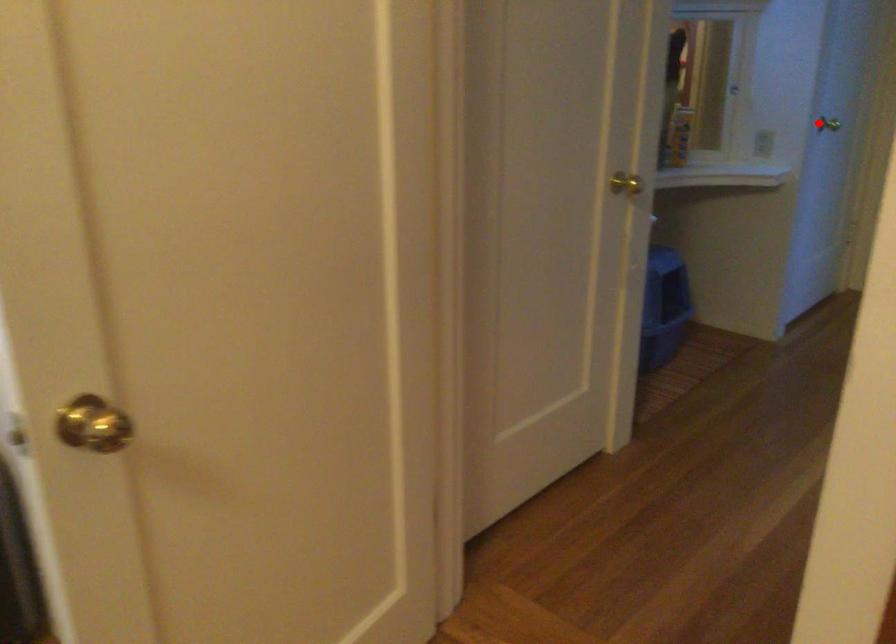
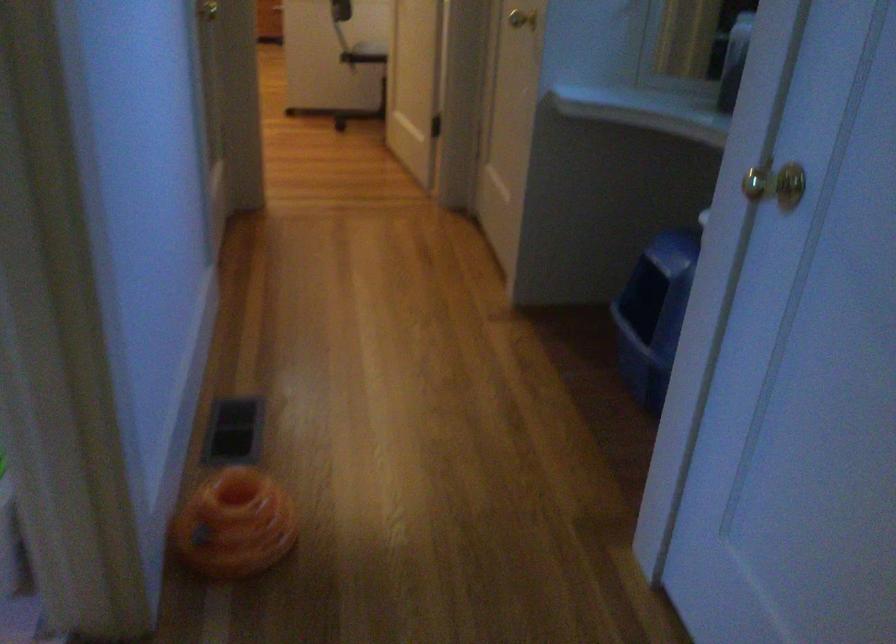
Find the pixel in the second image that matches the highlighted location in the first image.

(776, 184)